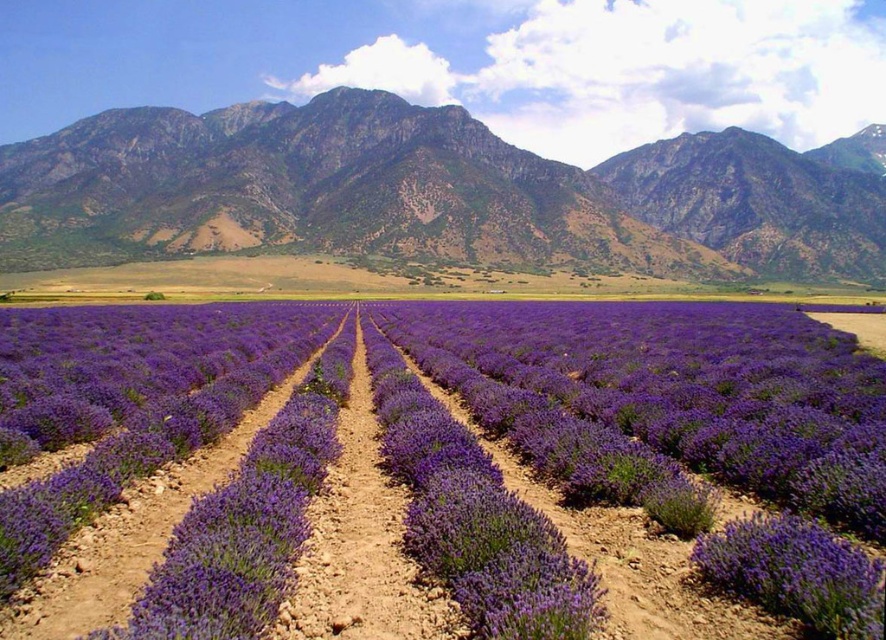
Question: Considering the relative positions of purple soft-textured lavender at center and brown soil path at center in the image provided, where is purple soft-textured lavender at center located with respect to brown soil path at center?

Choices:
 (A) below
 (B) above

Answer: (B)

Question: Considering the real-world distances, which object is farthest from the rugged stone mountain range at upper center?

Choices:
 (A) purple soft-textured lavender at center
 (B) brown soil path at center

Answer: (B)

Question: Can you confirm if rugged stone mountain range at upper center is thinner than purple soft-textured lavender at center?

Choices:
 (A) no
 (B) yes

Answer: (A)

Question: Can you confirm if rugged stone mountain range at upper center is smaller than brown soil path at center?

Choices:
 (A) yes
 (B) no

Answer: (B)

Question: Which point is farther to the camera?

Choices:
 (A) purple soft-textured lavender at center
 (B) brown soil path at center
 (C) rugged stone mountain range at upper center

Answer: (C)

Question: Among these objects, which one is nearest to the camera?

Choices:
 (A) rugged stone mountain range at upper center
 (B) brown soil path at center

Answer: (B)